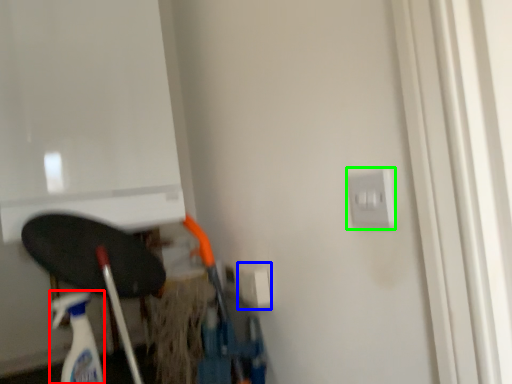
Question: Considering the real-world distances, which object is farthest from cleaning product (highlighted by a red box)? electric outlet (highlighted by a blue box) or electric outlet (highlighted by a green box)?

Choices:
 (A) electric outlet
 (B) electric outlet

Answer: (B)